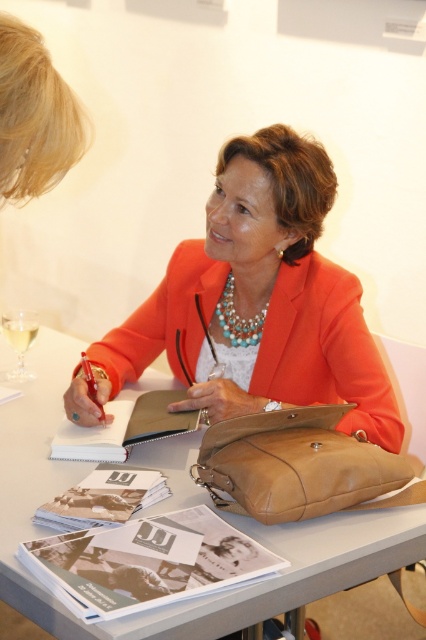
Which is behind, point (365, 464) or point (256, 340)?

The point (256, 340) is more distant.

Is leather bag at center to the left of turquoise pearl necklace at center from the viewer's perspective?

In fact, leather bag at center is to the right of turquoise pearl necklace at center.

From the picture: Who is more distant from viewer, [298,490] or [226,312]?

Positioned behind is point [226,312].

Locate an element on the screen. This screenshot has height=640, width=426. leather bag at center is located at coordinates (293, 465).

Is point (175, 362) positioned after point (226, 298)?

Yes.

Who is taller, orange leather jacket at center or turquoise pearl necklace at center?

Standing taller between the two is orange leather jacket at center.

Identify the location of orange leather jacket at center. (261, 300).

Can you confirm if turquoise pearl necklace at center is smaller than clear glass wine glass at left?

Correct, turquoise pearl necklace at center occupies less space than clear glass wine glass at left.

Who is positioned more to the left, turquoise pearl necklace at center or clear glass wine glass at left?

From the viewer's perspective, clear glass wine glass at left appears more on the left side.

Is point (262, 321) positioned in front of point (16, 378)?

Yes.

Identify the location of turquoise pearl necklace at center. (238, 317).